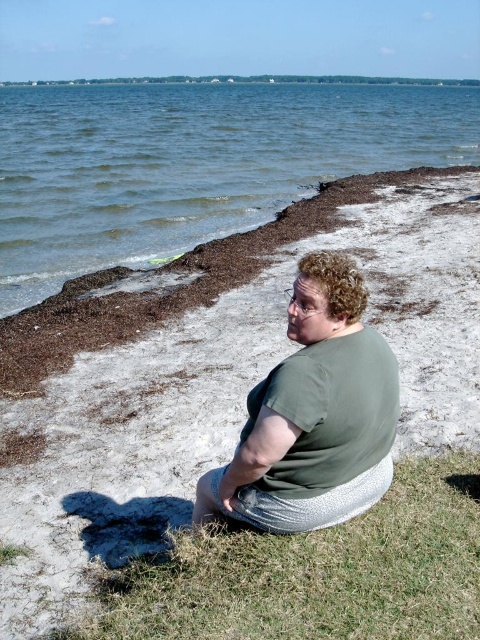
Which is more to the right, brown sandy beach at lower left or green fabric shirt at center?

green fabric shirt at center

Is point (300, 211) positioned before point (297, 429)?

No, (300, 211) is behind (297, 429).

You are a GUI agent. You are given a task and a screenshot of the screen. Output one action in this format:
    pyautogui.click(x=<x>, y=<y>)
    Task: Click on the brown sandy beach at lower left
    
    Given the screenshot: What is the action you would take?
    pyautogui.click(x=228, y=381)

Which is behind, point (316, 248) or point (468, 132)?

Point (468, 132)

Between point (408, 353) and point (226, 214), which one is positioned in front?

Point (408, 353) is in front.

Which is in front, point (101, 396) or point (72, 163)?

Point (101, 396)

Where is `brown sandy beach at lower left`? brown sandy beach at lower left is located at coordinates (228, 381).

Can you confirm if blue water at upper center is positioned to the right of green fabric shirt at center?

Incorrect, blue water at upper center is not on the right side of green fabric shirt at center.

Who is lower down, blue water at upper center or green fabric shirt at center?

green fabric shirt at center

Identify the location of blue water at upper center. (192, 163).